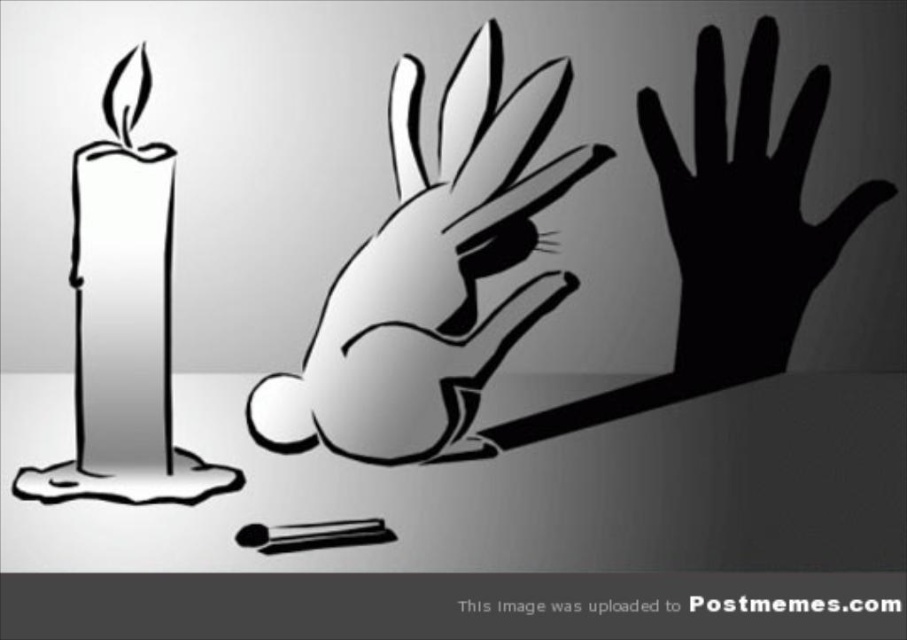
How much distance is there between shiny silver bunny at center and white matte candle at left?

They are 3.35 inches apart.

Who is higher up, shiny silver bunny at center or white matte candle at left?

shiny silver bunny at center is above.

Measure the distance between point [451,216] and camera.

Point [451,216] is 16.85 inches away from camera.

The height and width of the screenshot is (640, 907). In order to click on shiny silver bunny at center in this screenshot , I will do `click(432, 275)`.

Between shiny silver bunny at center and black shadow hand at right, which one appears on the left side from the viewer's perspective?

From the viewer's perspective, shiny silver bunny at center appears more on the left side.

Based on the photo, is shiny silver bunny at center further to camera compared to black shadow hand at right?

No, it is in front of black shadow hand at right.

Identify the location of shiny silver bunny at center. This screenshot has height=640, width=907. (432, 275).

Does black shadow hand at right lie behind white matte candle at left?

Yes, black shadow hand at right is behind white matte candle at left.

Between black shadow hand at right and white matte candle at left, which one is positioned lower?

white matte candle at left is below.

Where is `black shadow hand at right`? The image size is (907, 640). black shadow hand at right is located at coordinates (745, 212).